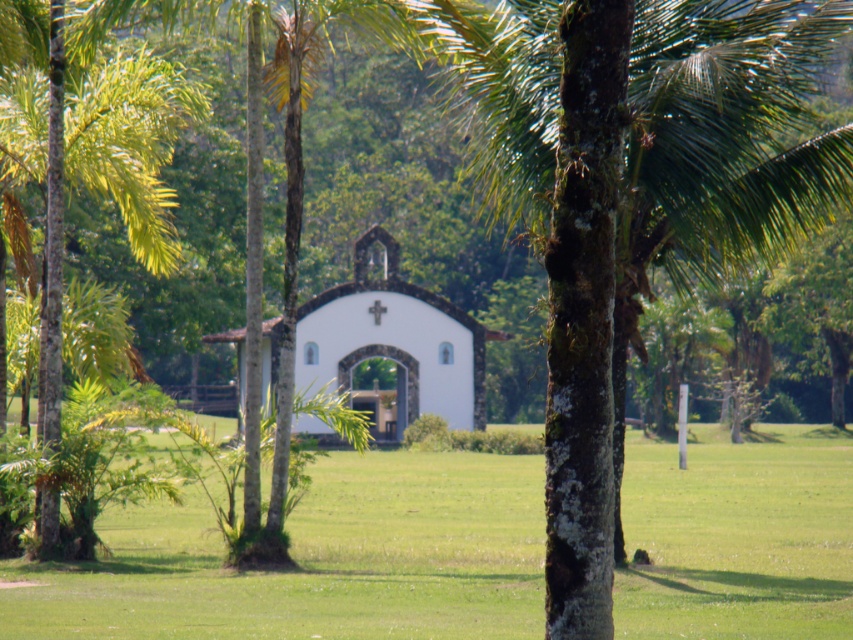
Is point (691, 513) in front of point (49, 147)?

No, (691, 513) is behind (49, 147).

Can you confirm if green grass at center is smaller than green leafy palm tree at lower left?

Actually, green grass at center might be larger than green leafy palm tree at lower left.

The height and width of the screenshot is (640, 853). What do you see at coordinates (316, 561) in the screenshot?
I see `green grass at center` at bounding box center [316, 561].

At what (x,y) coordinates should I click in order to perform the action: click on green grass at center. Please return your answer as a coordinate pair (x, y). Looking at the image, I should click on [x=316, y=561].

Is green leafy palm tree at lower left to the right of white matte church at center from the viewer's perspective?

In fact, green leafy palm tree at lower left is to the left of white matte church at center.

Measure the distance between point (42, 534) and camera.

Point (42, 534) is 25.81 meters from camera.

Find the location of a particular element. Image resolution: width=853 pixels, height=640 pixels. green leafy palm tree at lower left is located at coordinates (90, 170).

Does point (780, 218) lie behind point (520, 516)?

No, it is not.

Between point (561, 365) and point (345, 470), which one is positioned behind?

Point (345, 470)

Find the location of a particular element. This screenshot has height=640, width=853. green rough bark palm tree at center is located at coordinates (631, 198).